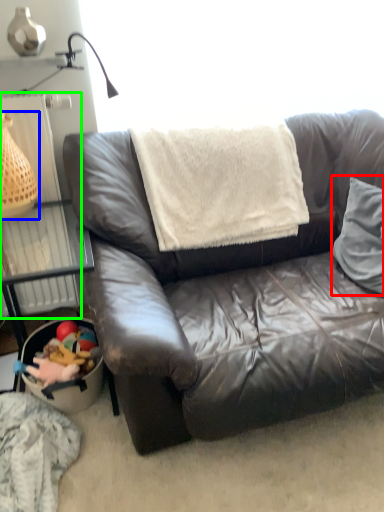
Question: Which object is the closest to the throw pillow (highlighted by a red box)? Choose among these: basket (highlighted by a blue box) or radiator (highlighted by a green box).

Choices:
 (A) basket
 (B) radiator

Answer: (B)